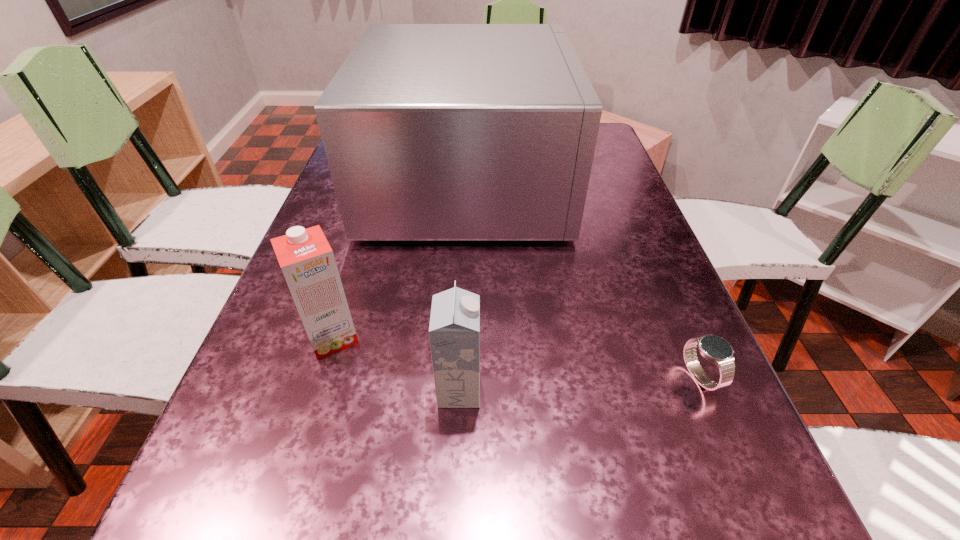
You are a GUI agent. You are given a task and a screenshot of the screen. Output one action in this format:
    pyautogui.click(x=<x>, y=<y>)
    Task: Click on the object located at the far edge
    The height and width of the screenshot is (540, 960).
    Given the screenshot: What is the action you would take?
    pyautogui.click(x=433, y=132)

Identify the location of microwave oven present at the left edge. (433, 132).

This screenshot has height=540, width=960. In order to click on carton located at the left edge in this screenshot , I will do `click(306, 259)`.

Find the location of a particular element. The image size is (960, 540). object that is positioned at the right edge is located at coordinates (713, 348).

This screenshot has height=540, width=960. I want to click on object positioned at the far left corner, so click(x=433, y=132).

Locate an element on the screen. free point at the left edge is located at coordinates (287, 443).

Where is `vacant space at the right edge of the desktop`? This screenshot has width=960, height=540. vacant space at the right edge of the desktop is located at coordinates (674, 315).

Identify the location of free area in between the farthest object and the farther carton. Image resolution: width=960 pixels, height=540 pixels. (400, 259).

I want to click on empty space that is in between the right carton and the farther carton, so click(396, 363).

This screenshot has height=540, width=960. What are the coordinates of `unoccupied position between the rightmost object and the tallest object` in the screenshot? It's located at click(x=585, y=279).